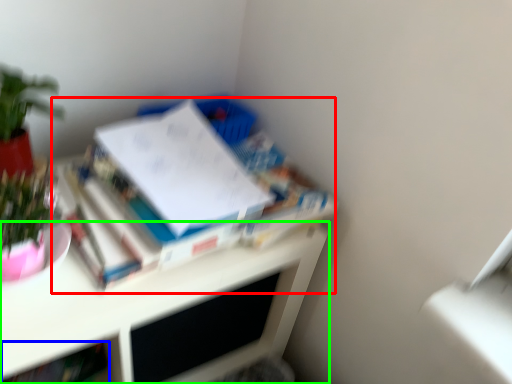
Question: Estimate the real-world distances between objects in this image. Which object is closer to book (highlighted by a red box), book (highlighted by a blue box) or desk (highlighted by a green box)?

Choices:
 (A) book
 (B) desk

Answer: (B)